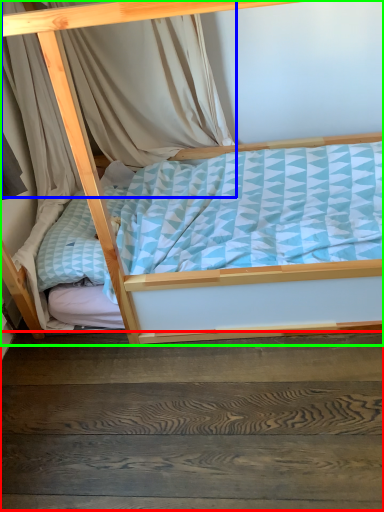
Question: Which object is positioned closest to stairwell (highlighted by a red box)? Select from curtain (highlighted by a blue box) and bed (highlighted by a green box).

Choices:
 (A) curtain
 (B) bed

Answer: (B)